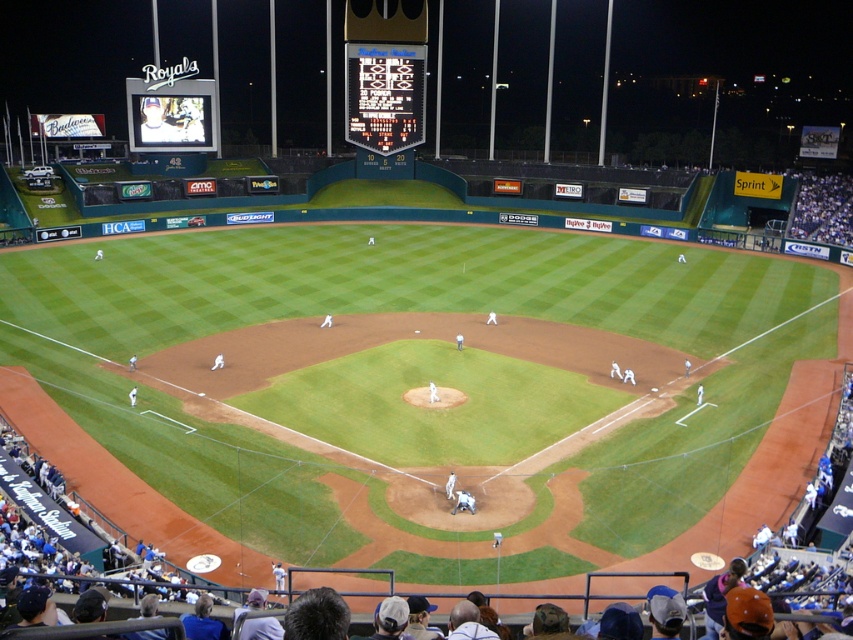
Question: Which of the following is the farthest from the observer?

Choices:
 (A) (152, 120)
 (B) (392, 125)

Answer: (B)

Question: Does black digital scoreboard at upper center lie behind matte black scoreboard at upper left?

Choices:
 (A) no
 (B) yes

Answer: (B)

Question: Is black digital scoreboard at upper center closer to the viewer compared to matte black scoreboard at upper left?

Choices:
 (A) no
 (B) yes

Answer: (A)

Question: Which object appears farthest from the camera in this image?

Choices:
 (A) matte black scoreboard at upper left
 (B) black digital scoreboard at upper center

Answer: (B)

Question: Does black digital scoreboard at upper center lie behind matte black scoreboard at upper left?

Choices:
 (A) no
 (B) yes

Answer: (B)

Question: Which point is farther to the camera?

Choices:
 (A) (422, 54)
 (B) (167, 134)

Answer: (A)